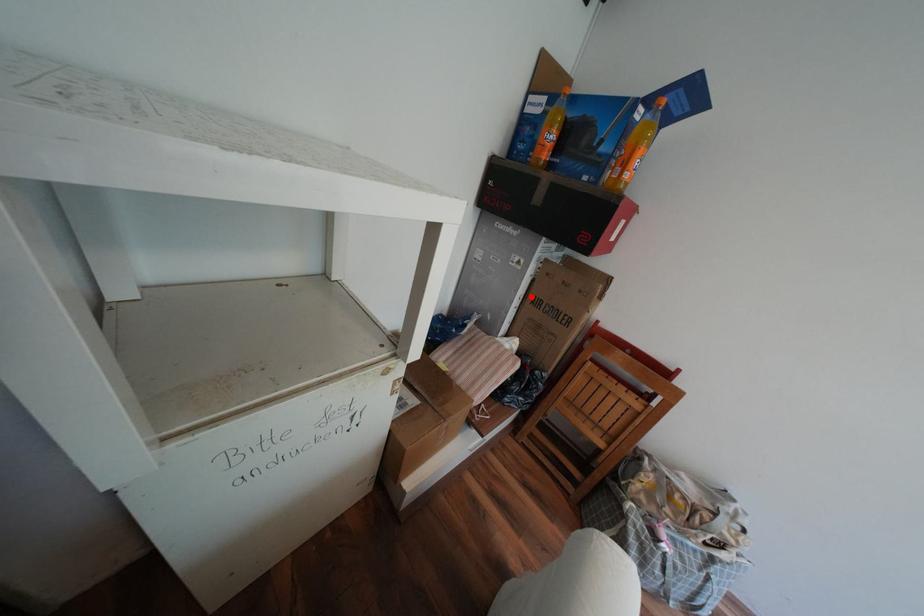
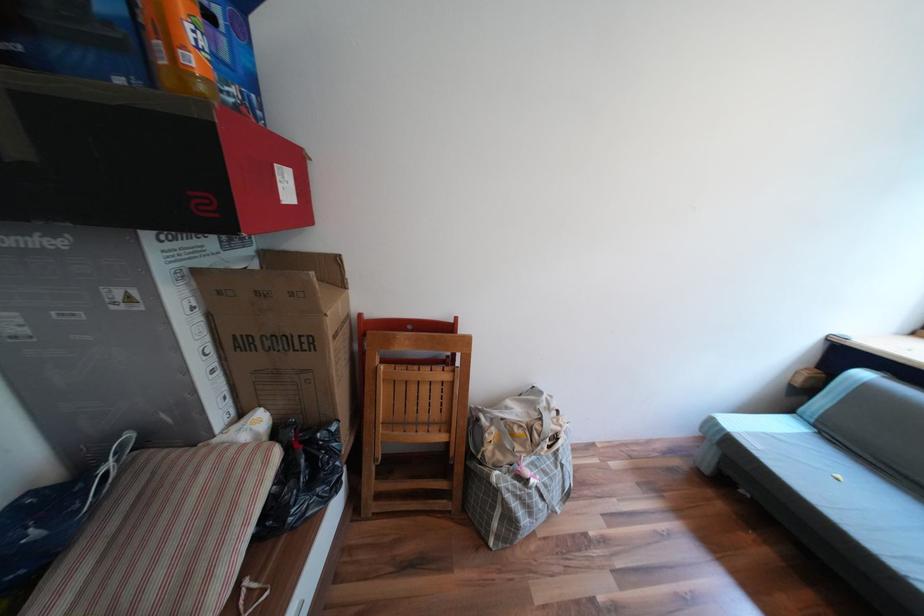
In the second image, find the point that corresponds to the highlighted location in the first image.

(219, 349)